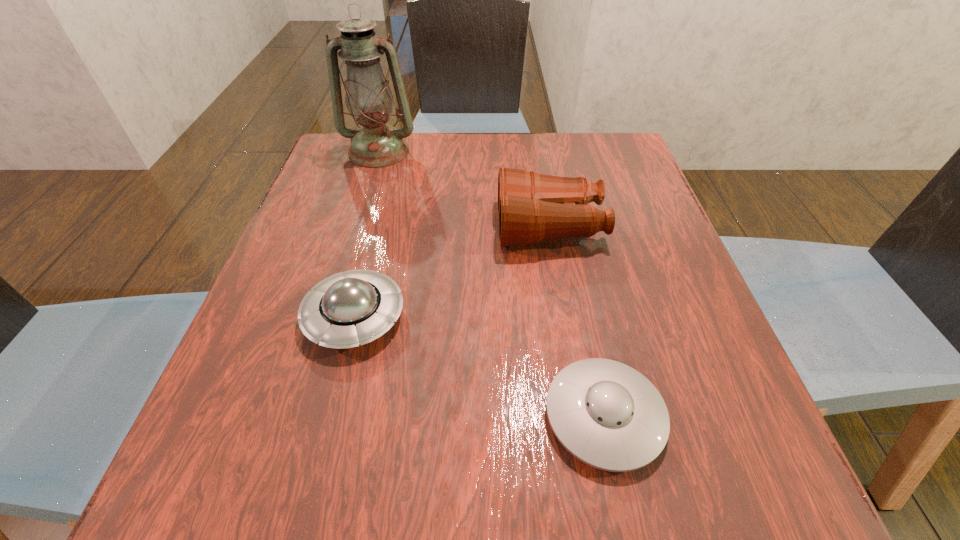
This screenshot has width=960, height=540. I want to click on the tallest object, so click(x=369, y=100).

The width and height of the screenshot is (960, 540). I want to click on the farthest object, so click(x=369, y=100).

You are a GUI agent. You are given a task and a screenshot of the screen. Output one action in this format:
    pyautogui.click(x=<x>, y=<y>)
    Task: Click on the binoculars
    The height and width of the screenshot is (540, 960).
    Given the screenshot: What is the action you would take?
    pyautogui.click(x=532, y=207)

The image size is (960, 540). I want to click on the second farthest object, so click(532, 207).

The width and height of the screenshot is (960, 540). Identify the location of the taller saucer. (344, 310).

Identify the location of the farther saucer. (344, 310).

Locate an element on the screen. the nearer saucer is located at coordinates (605, 413).

You are a GUI agent. You are given a task and a screenshot of the screen. Output one action in this format:
    pyautogui.click(x=<x>, y=<y>)
    Task: Click on the right saucer
    This screenshot has height=540, width=960.
    Given the screenshot: What is the action you would take?
    pyautogui.click(x=605, y=413)

Image resolution: width=960 pixels, height=540 pixels. I want to click on free point located on the right of the oil lamp, so click(x=444, y=152).

Find the location of `free space located 0.250m through the lenses of the third nearest object`. free space located 0.250m through the lenses of the third nearest object is located at coordinates (378, 226).